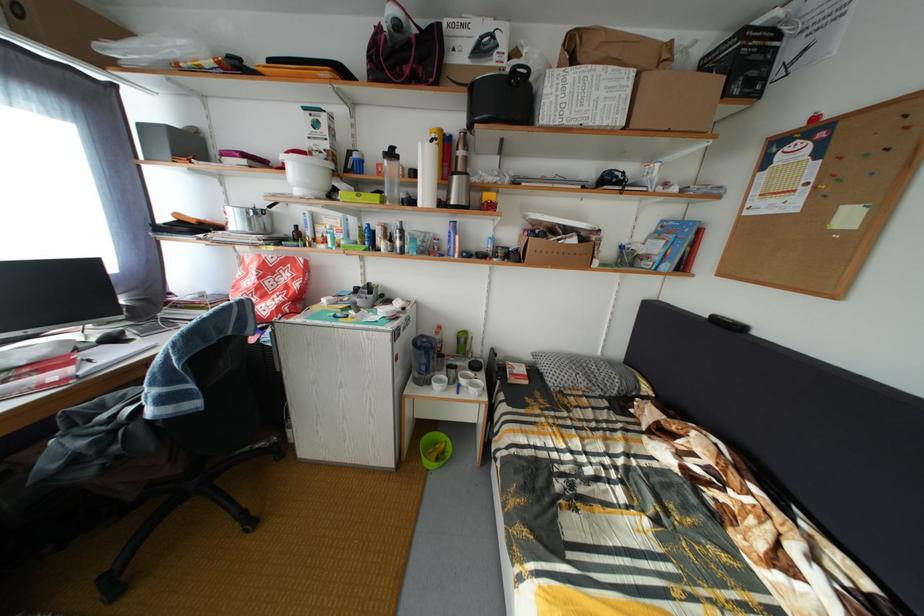
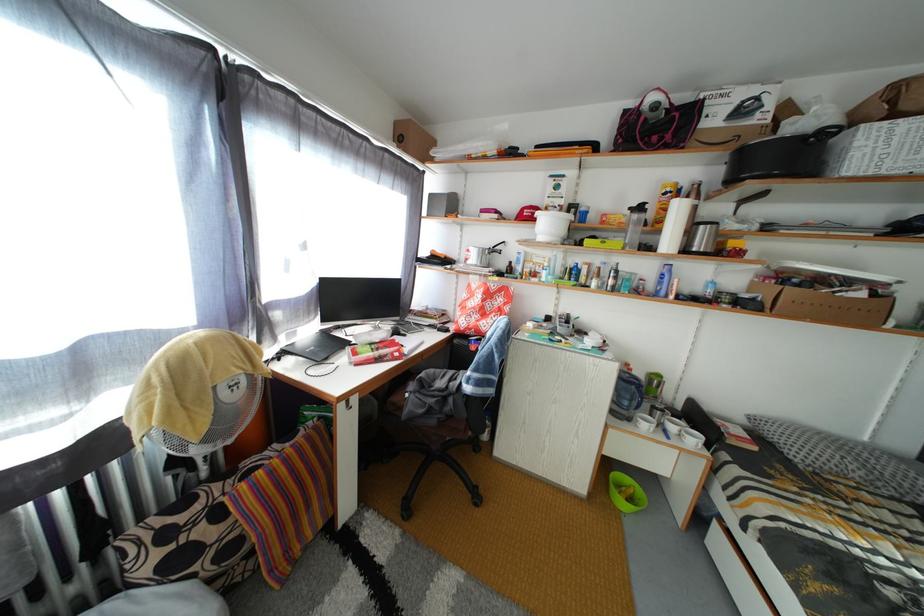
Which direction would the cameraman need to move to produce the second image?

The cameraman walked toward left, backward.